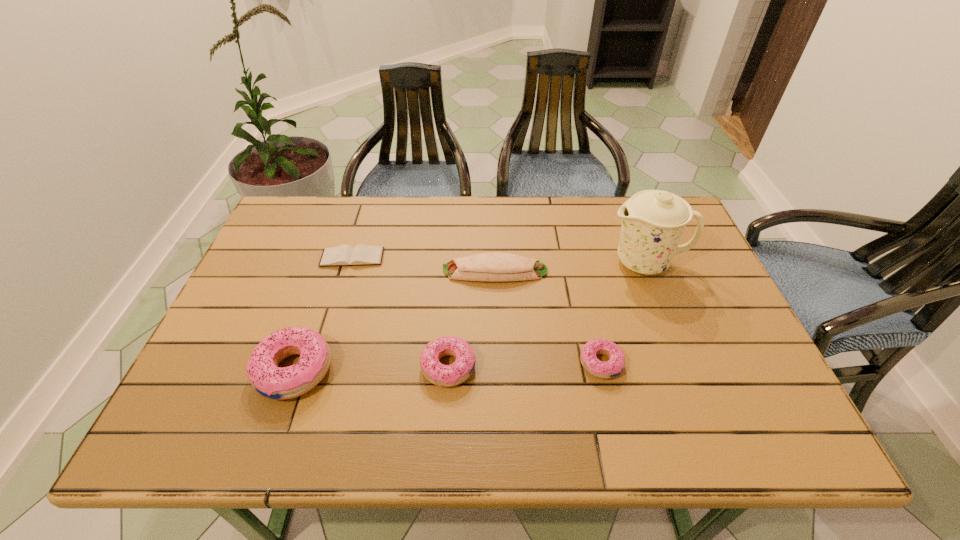
Observe the arrangement of all doughnuts in the image. To keep them evenly spaced, where would you place another doughnut on the right? Please locate a free space. Please provide its 2D coordinates. Your answer should be formatted as a tuple, i.e. [(x, y)], where the tuple contains the x and y coordinates of a point satisfying the conditions above.

[(752, 359)]